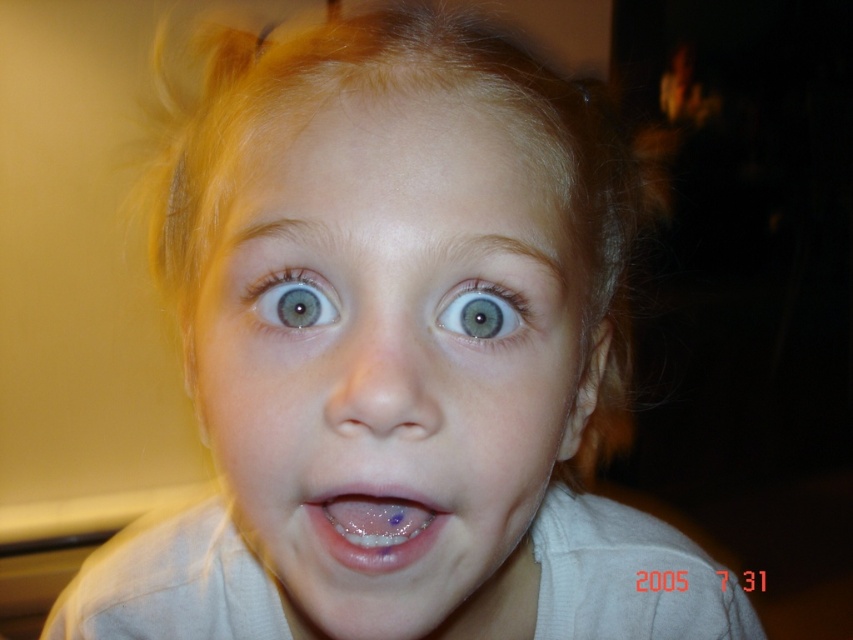
Does shiny silver tongue at center have a lesser width compared to blue glossy eye at center?

In fact, shiny silver tongue at center might be wider than blue glossy eye at center.

Describe the element at coordinates (373, 528) in the screenshot. I see `shiny silver tongue at center` at that location.

Is point (373, 496) in front of point (293, 323)?

That is True.

At what (x,y) coordinates should I click in order to perform the action: click on shiny silver tongue at center. Please return your answer as a coordinate pair (x, y). Looking at the image, I should click on (373, 528).

Is smooth skin face at center wider than shiny silver tongue at center?

Yes.

Between smooth skin face at center and shiny silver tongue at center, which one has less height?

With less height is shiny silver tongue at center.

Who is more forward, (264, 154) or (405, 545)?

Point (405, 545) is more forward.

The image size is (853, 640). I want to click on smooth skin face at center, so click(x=395, y=368).

Is blue glossy eye at center closer to the viewer compared to blue matte eye at center?

No, it is behind blue matte eye at center.

Between blue glossy eye at center and blue matte eye at center, which one is positioned lower?

blue matte eye at center is below.

Identify the location of blue glossy eye at center. The height and width of the screenshot is (640, 853). (294, 301).